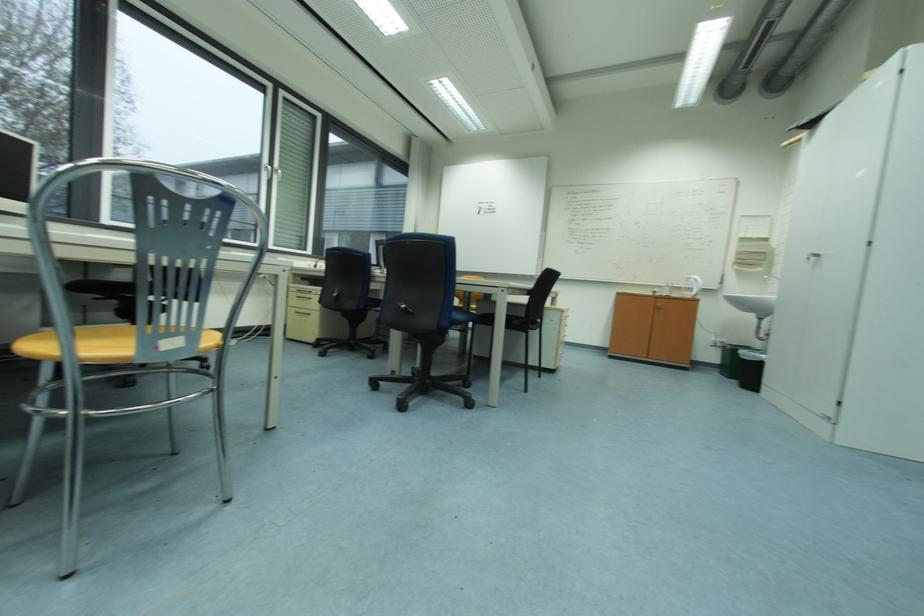
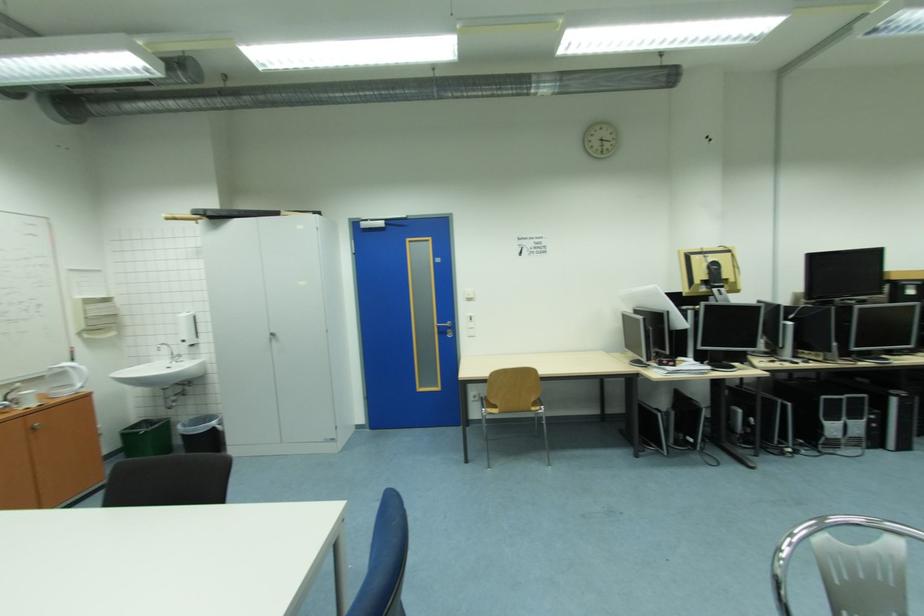
In the second image, find the point that corresponds to [772,358] in the first image.

(220, 424)